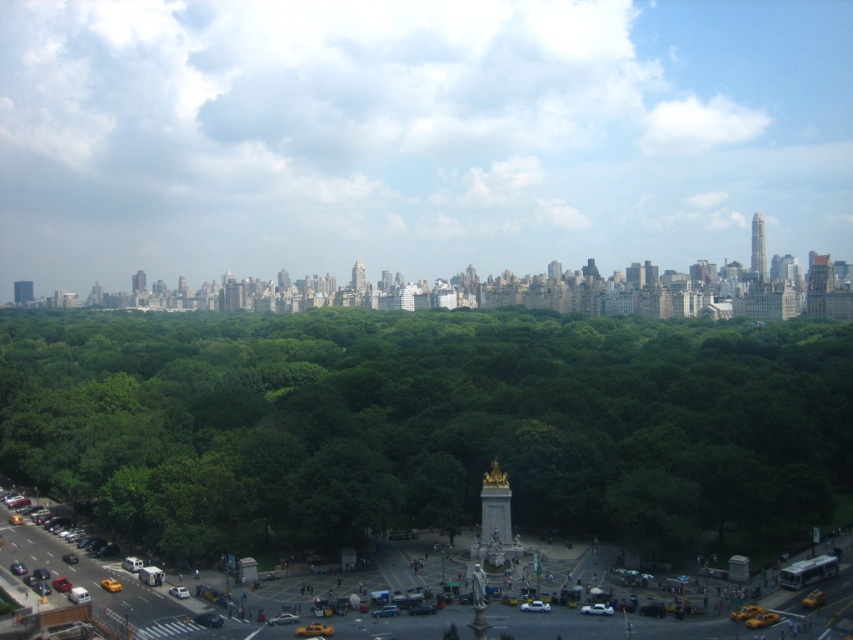
Question: Does green leafy trees at center appear on the left side of green glass tower at upper left?

Choices:
 (A) yes
 (B) no

Answer: (B)

Question: Can you confirm if gold metallic skyscraper at upper right is positioned above green glass tower at upper left?

Choices:
 (A) yes
 (B) no

Answer: (A)

Question: Which point is closer to the camera?

Choices:
 (A) green leafy trees at center
 (B) gold metallic spire at center
 (C) green glass tower at upper left

Answer: (A)

Question: Which object is farther from the camera taking this photo?

Choices:
 (A) green leafy trees at center
 (B) green glass tower at upper left

Answer: (B)

Question: In this image, where is green leafy trees at center located relative to green glass tower at upper left?

Choices:
 (A) left
 (B) right

Answer: (B)

Question: Which point is farther from the camera taking this photo?

Choices:
 (A) (21, 289)
 (B) (752, 253)
 (C) (363, 289)
 (D) (123, 433)

Answer: (A)